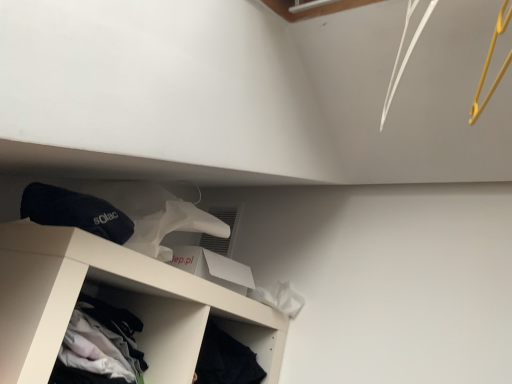
What do you see at coordinates (75, 212) in the screenshot? I see `black terry cloth socks at upper left` at bounding box center [75, 212].

I want to click on black terry cloth socks at upper left, so click(75, 212).

Measure the distance between black terry cloth socks at upper left and camera.

The distance of black terry cloth socks at upper left from camera is 29.09 inches.

Locate an element on the screen. The height and width of the screenshot is (384, 512). black terry cloth socks at upper left is located at coordinates (75, 212).